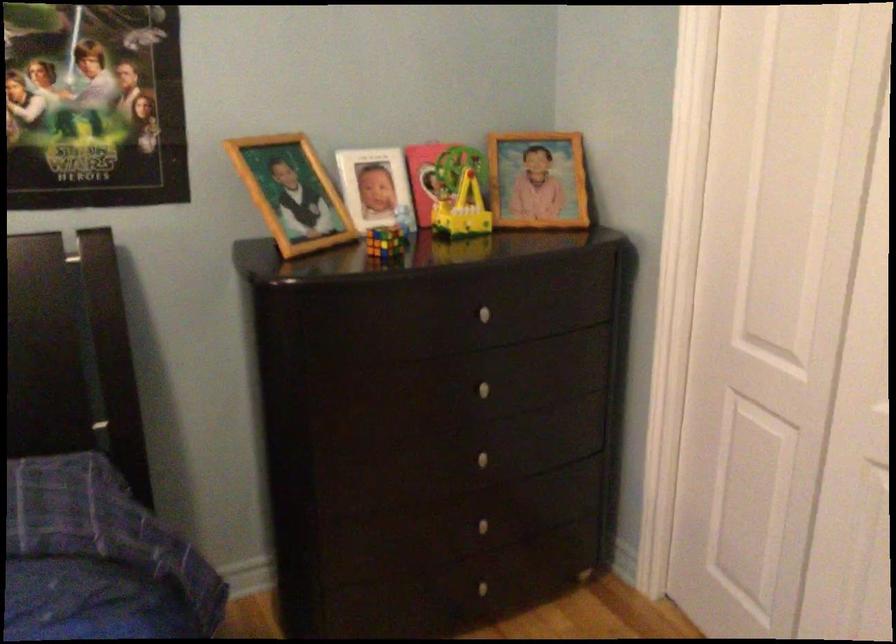
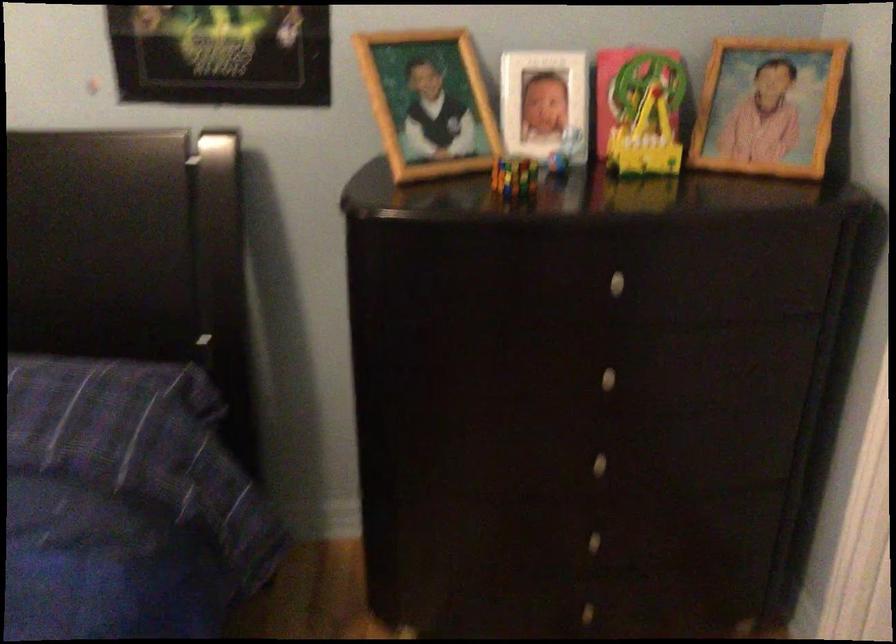
Question: How did the camera likely rotate?

Choices:
 (A) Left
 (B) Right
 (C) Up
 (D) Down

Answer: (A)